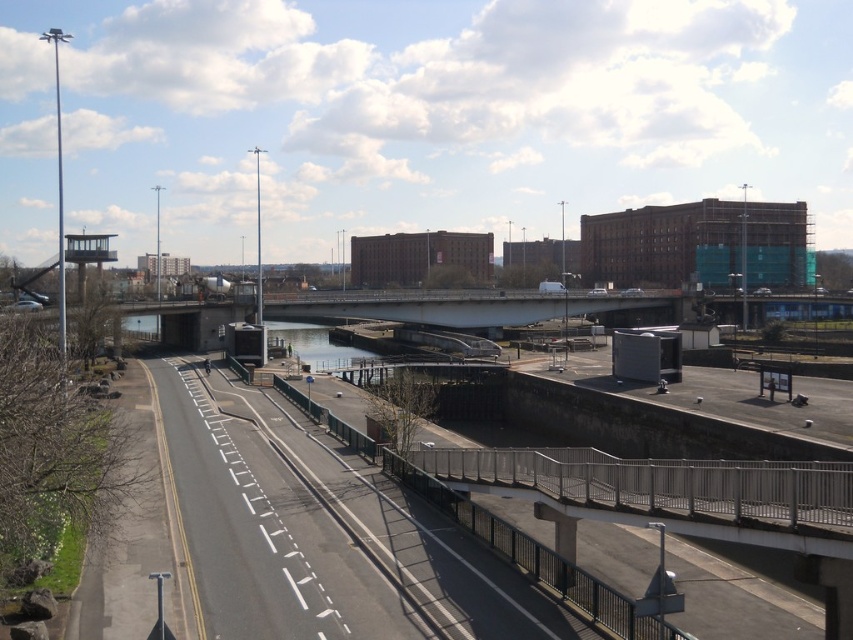
Does point (630, 298) lie behind point (326, 340)?

That is False.

Is white concrete bridge at center in front of clear water at center?

No, white concrete bridge at center is further to the viewer.

Which is behind, point (433, 323) or point (297, 342)?

Positioned behind is point (297, 342).

Locate an element on the screen. Image resolution: width=853 pixels, height=640 pixels. white concrete bridge at center is located at coordinates (461, 305).